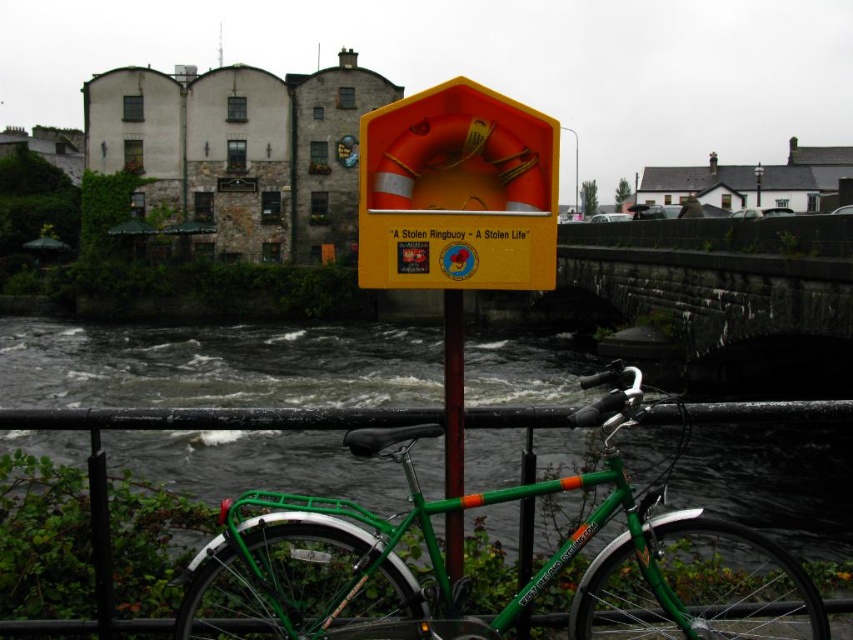
You are standing at the riverside and want to take a photo of the two points marked in the image. Which point, point (x=412, y=600) or point (x=461, y=545), will appear larger in your photo?

Point (x=412, y=600) will appear larger in your photo because it is closer to the camera than point (x=461, y=545).